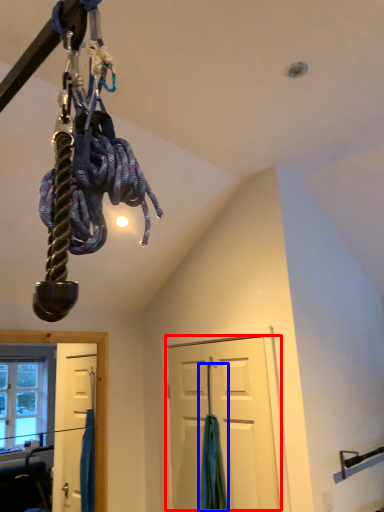
Question: Which of the following is the farthest to the observer, door (highlighted by a red box) or curtain (highlighted by a blue box)?

Choices:
 (A) door
 (B) curtain

Answer: (B)